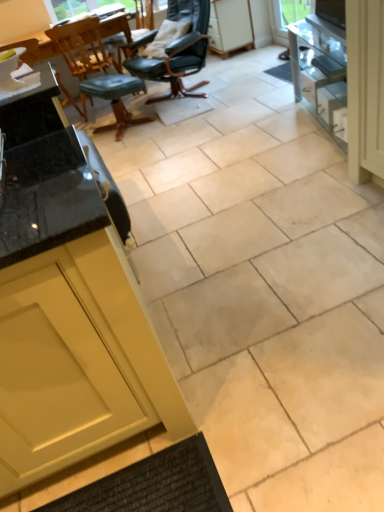
Locate an element on the screen. The image size is (384, 512). free point to the right of green leather stool at center is located at coordinates (167, 105).